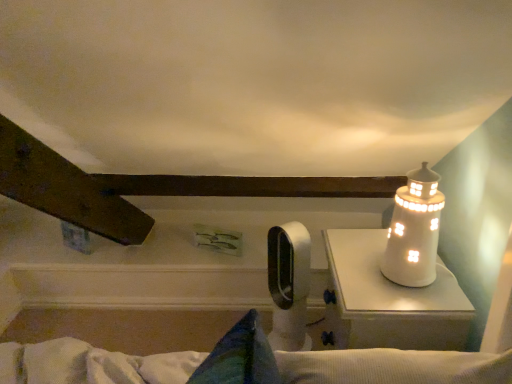
Question: Can you confirm if white ceramic lighthouse at upper right is wider than white plastic fan at center?

Choices:
 (A) yes
 (B) no

Answer: (B)

Question: Is white ceramic lighthouse at upper right beside white plastic fan at center?

Choices:
 (A) yes
 (B) no

Answer: (B)

Question: From a real-world perspective, is white ceramic lighthouse at upper right positioned under white plastic fan at center based on gravity?

Choices:
 (A) yes
 (B) no

Answer: (B)

Question: From a real-world perspective, is white ceramic lighthouse at upper right physically above white plastic fan at center?

Choices:
 (A) no
 (B) yes

Answer: (B)

Question: Can you confirm if white ceramic lighthouse at upper right is taller than white plastic fan at center?

Choices:
 (A) no
 (B) yes

Answer: (A)

Question: Considering the relative sizes of white ceramic lighthouse at upper right and white plastic fan at center in the image provided, is white ceramic lighthouse at upper right bigger than white plastic fan at center?

Choices:
 (A) no
 (B) yes

Answer: (A)

Question: Does white ceramic lighthouse at upper right touch white glossy lighthouse at right?

Choices:
 (A) no
 (B) yes

Answer: (A)

Question: Is white ceramic lighthouse at upper right not close to white glossy lighthouse at right?

Choices:
 (A) no
 (B) yes

Answer: (A)

Question: Is white ceramic lighthouse at upper right facing away from white glossy lighthouse at right?

Choices:
 (A) yes
 (B) no

Answer: (B)

Question: Does white ceramic lighthouse at upper right have a smaller size compared to white glossy lighthouse at right?

Choices:
 (A) yes
 (B) no

Answer: (A)

Question: From the image's perspective, is white ceramic lighthouse at upper right over white glossy lighthouse at right?

Choices:
 (A) yes
 (B) no

Answer: (A)

Question: Could you tell me if white ceramic lighthouse at upper right is facing white glossy lighthouse at right?

Choices:
 (A) yes
 (B) no

Answer: (B)

Question: Does white glossy lighthouse at right touch white ceramic lighthouse at upper right?

Choices:
 (A) yes
 (B) no

Answer: (B)